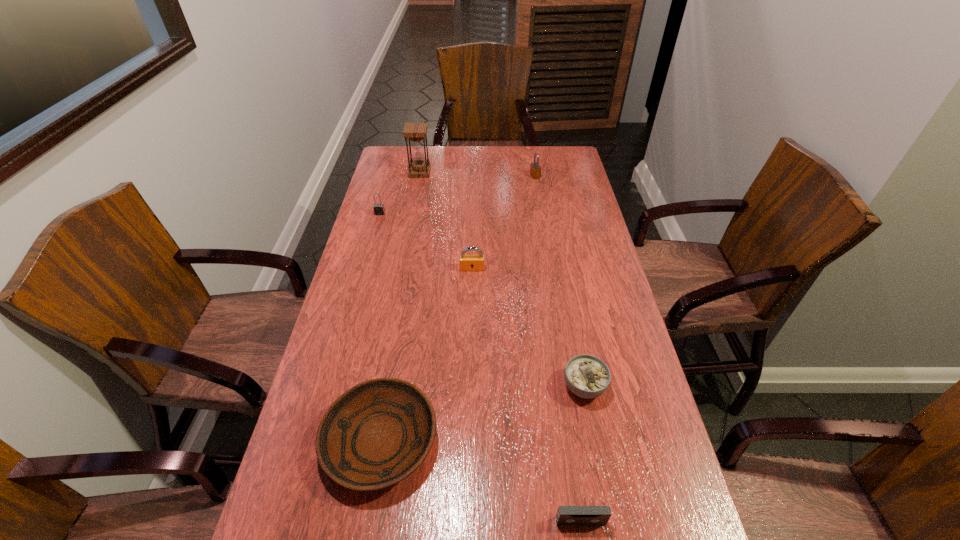
Image resolution: width=960 pixels, height=540 pixels. I want to click on object at the right edge, so click(x=587, y=376).

Find the location of a particular element. The image size is (960, 540). object that is positioned at the far left corner is located at coordinates (416, 132).

At what (x,y) coordinates should I click in order to perform the action: click on vacant region at the left edge of the desktop. Please return your answer as a coordinate pair (x, y). This screenshot has height=540, width=960. Looking at the image, I should click on (379, 312).

This screenshot has height=540, width=960. I want to click on free point at the right edge, so click(x=597, y=450).

Find the location of `vacant region at the far right corner of the desktop`. vacant region at the far right corner of the desktop is located at coordinates (549, 150).

I want to click on vacant area that lies between the plate and the farthest padlock, so click(x=458, y=308).

Locate an element on the screen. unoccupied position between the plate and the tallest object is located at coordinates (400, 307).

Image resolution: width=960 pixels, height=540 pixels. I want to click on free area in between the soup bowl and the leftmost padlock, so click(482, 300).

Image resolution: width=960 pixels, height=540 pixels. Find the location of `vacant region between the tallest object and the second padlock from right to left`. vacant region between the tallest object and the second padlock from right to left is located at coordinates (446, 220).

Locate an element on the screen. This screenshot has height=540, width=960. free space between the second padlock from left to right and the videotape is located at coordinates (526, 395).